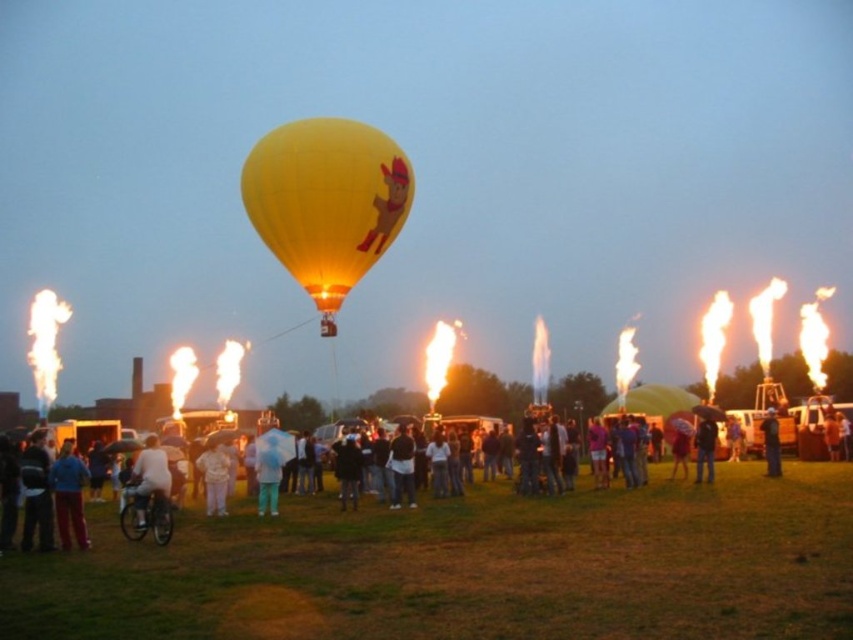
Looking at this image, you are a photographer trying to capture a photo of the yellow matte hot air balloon at center and the light blue fabric umbrella at center. If you want both objects to be fully visible in your frame without any part being cut off, which object should you position closer to the edge of the frame?

The light blue fabric umbrella at center should be positioned closer to the edge of the frame because the yellow matte hot air balloon at center might be wider than the light blue fabric umbrella at center, so placing the narrower object closer to the edge would allow both to fit within the frame.

Consider the image. You are a photographer at the hot air balloon festival and want to take a photo of the white matte shirt at center without the blue fabric jacket at lower left blocking it. How can you adjust your position to achieve this?

The blue fabric jacket at lower left is positioned over the white matte shirt at center, so to avoid blocking, move to the right side so the jacket is no longer in front of the shirt.

You are a photographer standing on the grassy field at the hot air balloon festival. You want to take a photo of the yellow matte hot air balloon at center and the light blue fabric umbrella at center. Based on their positions, which object should you focus on first to ensure both are in the frame?

The light blue fabric umbrella at center is located below the yellow matte hot air balloon at center, so you should focus on the light blue fabric umbrella at center first to ensure both are in the frame.